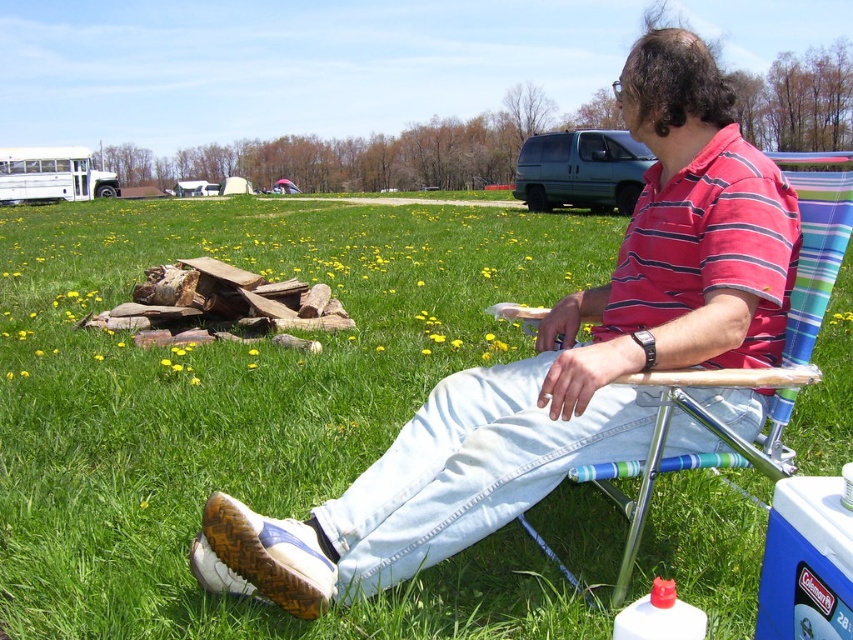
What are the coordinates of the striped cotton shirt at center?

The striped cotton shirt at center is located at coordinates point (556, 360).